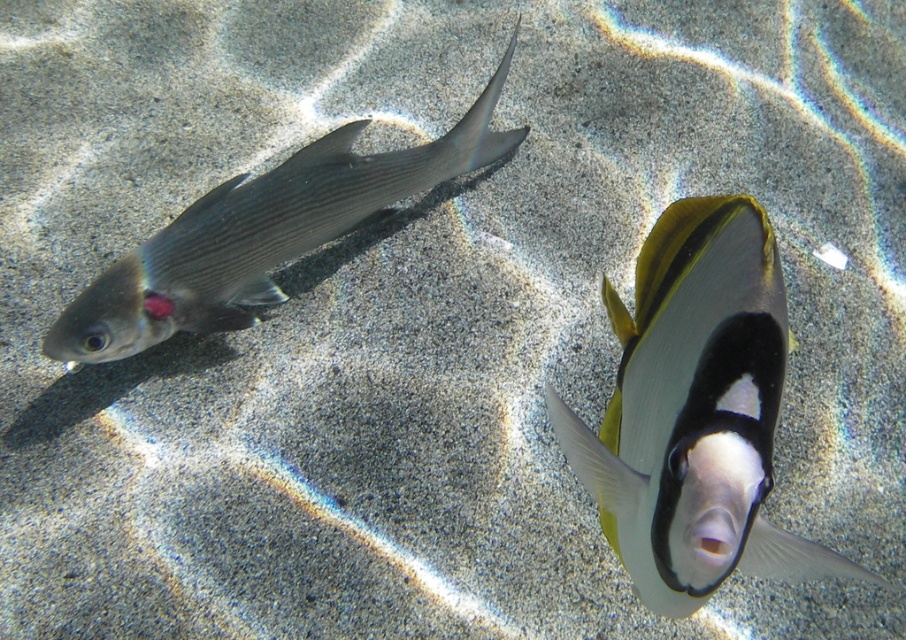
Question: Which point is closer to the camera?

Choices:
 (A) shiny silver fish at left
 (B) black glossy fish at center

Answer: (B)

Question: Is black glossy fish at center below shiny silver fish at left?

Choices:
 (A) no
 (B) yes

Answer: (B)

Question: Is black glossy fish at center above shiny silver fish at left?

Choices:
 (A) no
 (B) yes

Answer: (A)

Question: Where is black glossy fish at center located in relation to shiny silver fish at left in the image?

Choices:
 (A) right
 (B) left

Answer: (A)